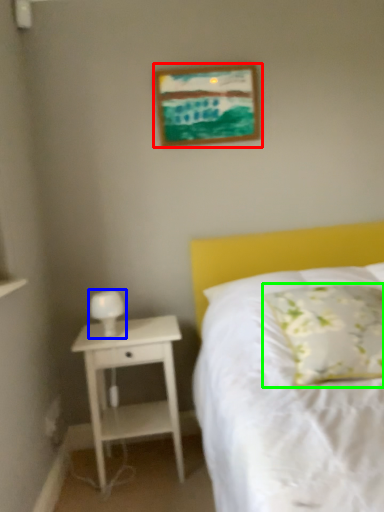
Question: Estimate the real-world distances between objects in this image. Which object is closer to picture frame (highlighted by a red box), bedside lamp (highlighted by a blue box) or pillow (highlighted by a green box)?

Choices:
 (A) bedside lamp
 (B) pillow

Answer: (A)